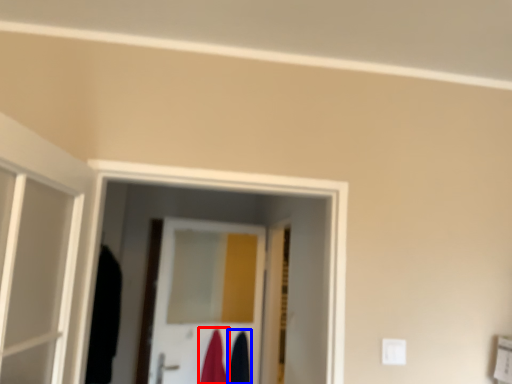
Question: Which object is further to the camera taking this photo, robe (highlighted by a red box) or robe (highlighted by a blue box)?

Choices:
 (A) robe
 (B) robe

Answer: (B)